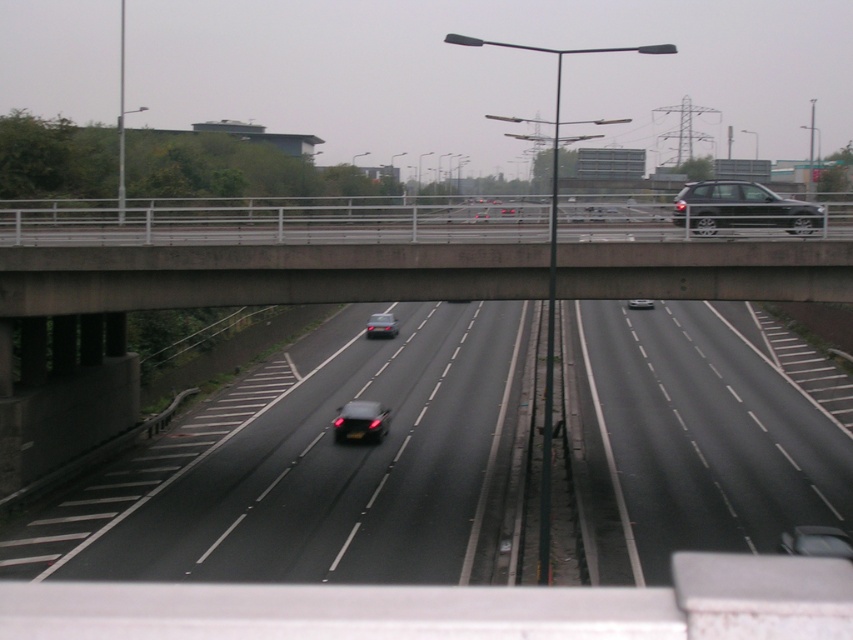
Which is in front, point (254, 564) or point (637, 301)?

Point (254, 564) is in front.

The image size is (853, 640). What do you see at coordinates (329, 468) in the screenshot? I see `black asphalt highway at center` at bounding box center [329, 468].

This screenshot has height=640, width=853. Describe the element at coordinates (329, 468) in the screenshot. I see `black asphalt highway at center` at that location.

You are a GUI agent. You are given a task and a screenshot of the screen. Output one action in this format:
    pyautogui.click(x=<x>, y=<y>)
    Task: Click on the black asphalt highway at center
    
    Given the screenshot: What is the action you would take?
    pyautogui.click(x=329, y=468)

Where is `shiny black sedan at center`? shiny black sedan at center is located at coordinates (381, 324).

Consider the image. Who is more distant from viewer, (x=373, y=316) or (x=630, y=304)?

Point (x=630, y=304)

At what (x,y) coordinates should I click in order to perform the action: click on shiny black sedan at center. Please return your answer as a coordinate pair (x, y). The image size is (853, 640). Looking at the image, I should click on (381, 324).

This screenshot has height=640, width=853. What are the coordinates of `shiny black sedan at center` in the screenshot? It's located at (381, 324).

Is concrete bridge at center bigger than shiny metallic car at right?

Indeed, concrete bridge at center has a larger size compared to shiny metallic car at right.

Locate an element on the screen. This screenshot has width=853, height=640. concrete bridge at center is located at coordinates (262, 253).

Between point (264, 282) and point (764, 211), which one is positioned behind?

The point (764, 211) is behind.

This screenshot has height=640, width=853. In order to click on concrete bridge at center in this screenshot , I will do `click(262, 253)`.